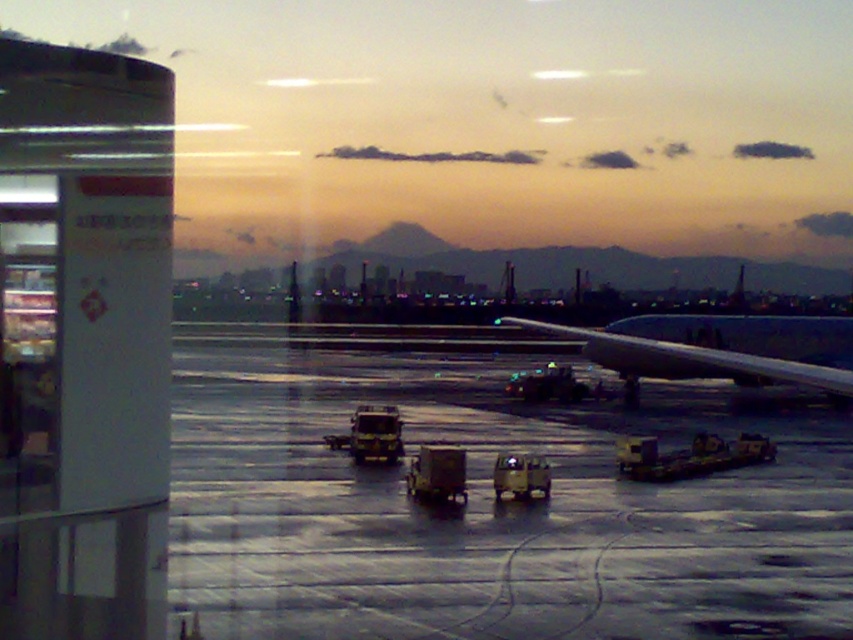
Question: Can you confirm if shiny gray tarmac at center is bigger than metallic gray airplane at right?

Choices:
 (A) yes
 (B) no

Answer: (A)

Question: Which point appears farthest from the camera in this image?

Choices:
 (A) (190, 353)
 (B) (825, 371)

Answer: (A)

Question: Can you confirm if shiny gray tarmac at center is positioned to the left of metallic gray airplane at right?

Choices:
 (A) yes
 (B) no

Answer: (A)

Question: Which object appears closest to the camera in this image?

Choices:
 (A) metallic gray airplane at right
 (B) shiny gray tarmac at center

Answer: (A)

Question: Is the position of shiny gray tarmac at center more distant than that of metallic gray airplane at right?

Choices:
 (A) no
 (B) yes

Answer: (B)